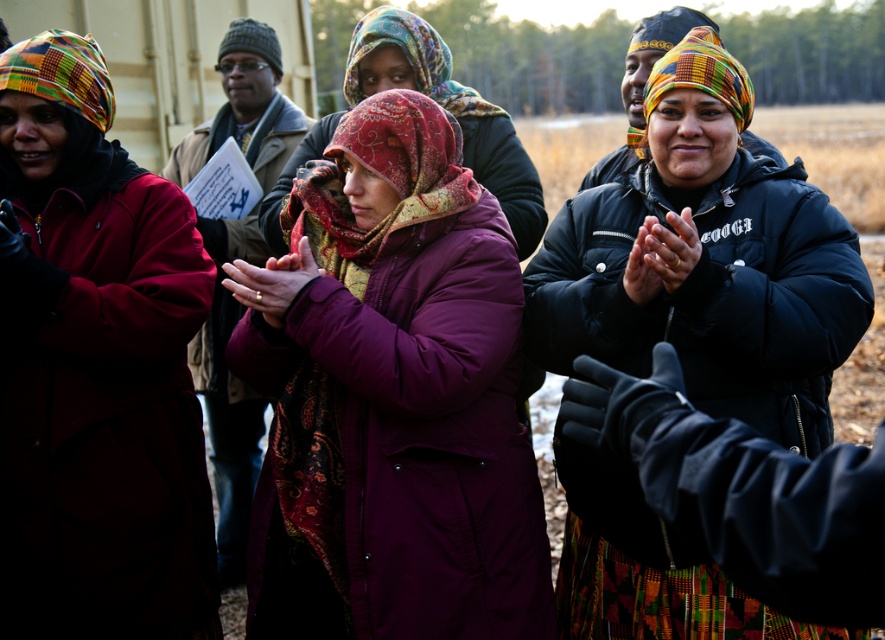
Is purple fleece jacket at center bigger than multicolored woven scarf at center?

Yes, purple fleece jacket at center is bigger than multicolored woven scarf at center.

Which of these two, purple fleece jacket at center or multicolored woven scarf at center, stands shorter?

multicolored woven scarf at center

Who is more distant from viewer, (498, 198) or (443, 68)?

The point (443, 68) is more distant.

This screenshot has width=885, height=640. Identify the location of purple fleece jacket at center. (448, 109).

Who is positioned more to the left, matte black jacket at center or patterned silk headscarf at center?

From the viewer's perspective, patterned silk headscarf at center appears more on the left side.

Does matte black jacket at center have a greater height compared to patterned silk headscarf at center?

Yes.

I want to click on matte black jacket at center, so point(705,260).

Identify the location of matte black jacket at center. The image size is (885, 640). (705, 260).

Looking at this image, who is more distant from viewer, (24, 362) or (602, 586)?

The point (24, 362) is more distant.

Is point (58, 529) positioned before point (847, 285)?

No, (58, 529) is behind (847, 285).

Where is `matte red coat at left`? The height and width of the screenshot is (640, 885). matte red coat at left is located at coordinates tap(95, 369).